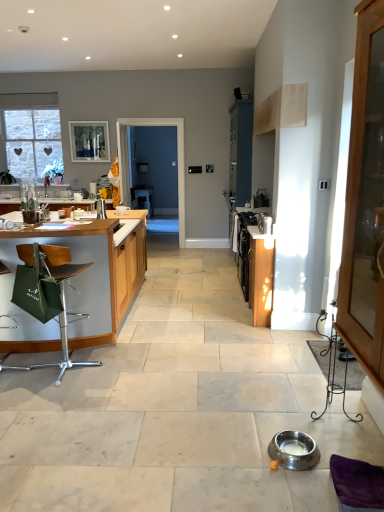
Locate an element on the screen. The width and height of the screenshot is (384, 512). vacant space in between purple fabric swivel chair at lower right and wooden cabinet at right, arranged as the first cabinetry when viewed from the back is located at coordinates (292, 378).